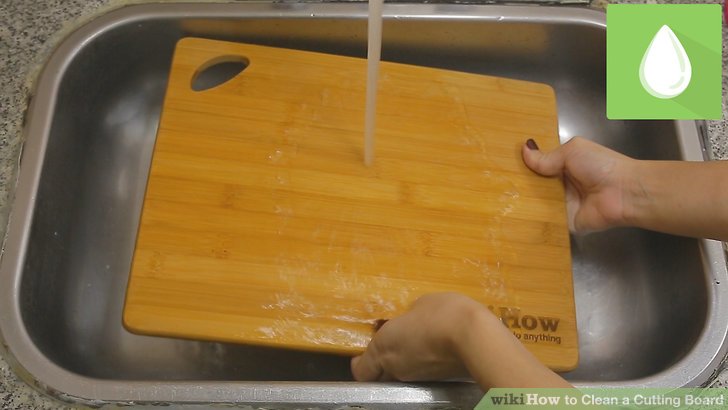
Where is `obscured brand of cutting board`? obscured brand of cutting board is located at coordinates (530, 324).